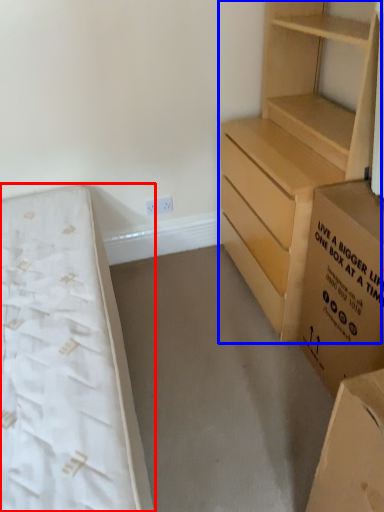
Question: Which point is closer to the camera, bed (highlighted by a red box) or chest of drawers (highlighted by a blue box)?

Choices:
 (A) bed
 (B) chest of drawers

Answer: (A)